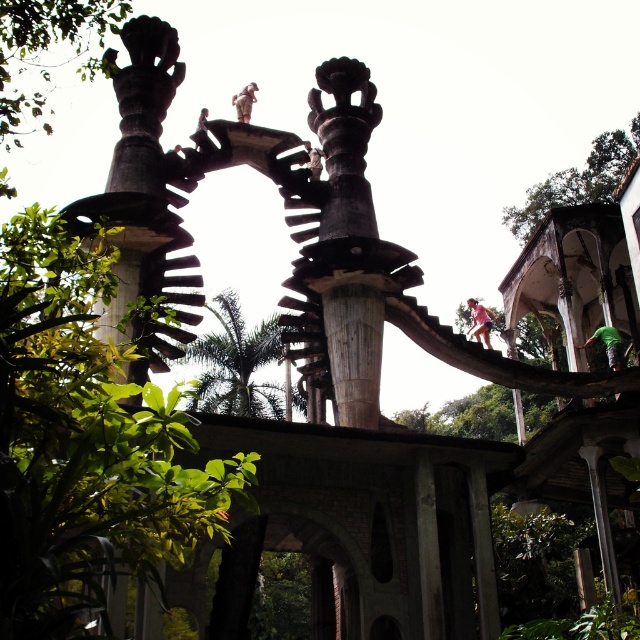
You are an architect analyzing the image of the abandoned structure. You notice two green leafy trees in the scene. Which tree, the green leafy tree at upper left or the green leafy tree at center, appears bigger in size?

The green leafy tree at upper left has a larger size compared to the green leafy tree at center.

You are standing at the entrance of the abandoned building and want to take a photo of the green leafy tree at left. Where should you position yourself to capture it in the frame?

To capture the green leafy tree at left in your photo, position yourself at point (84, 444) where the tree is located.